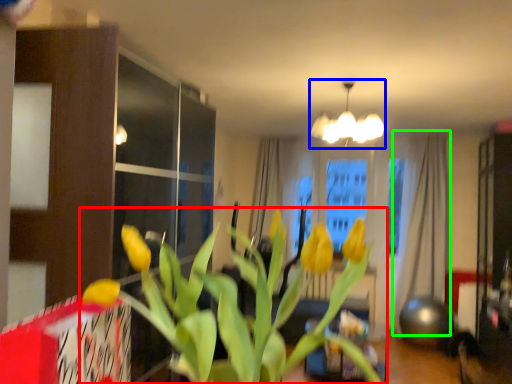
Question: Which object is the closest to the houseplant (highlighted by a red box)? Choose among these: lamp (highlighted by a blue box) or curtain (highlighted by a green box).

Choices:
 (A) lamp
 (B) curtain

Answer: (A)